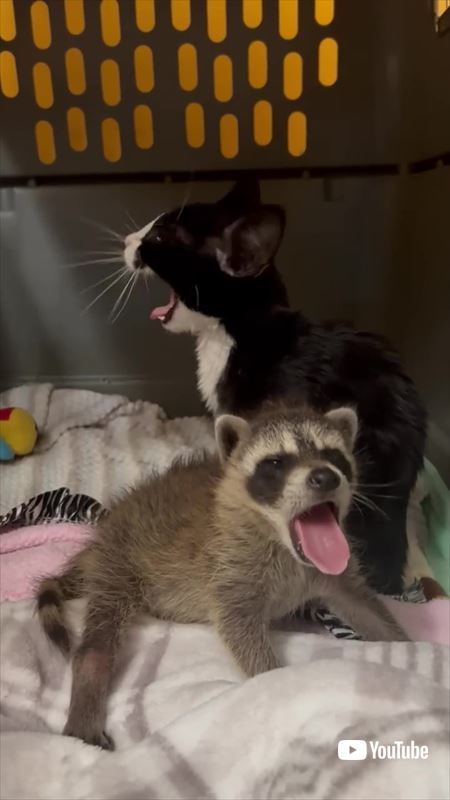
At what (x,y) coordinates should I click in order to perform the action: click on upper carrier wall. Please return your answer as a coordinate pair (x, y). Looking at the image, I should click on (360, 110), (13, 134).